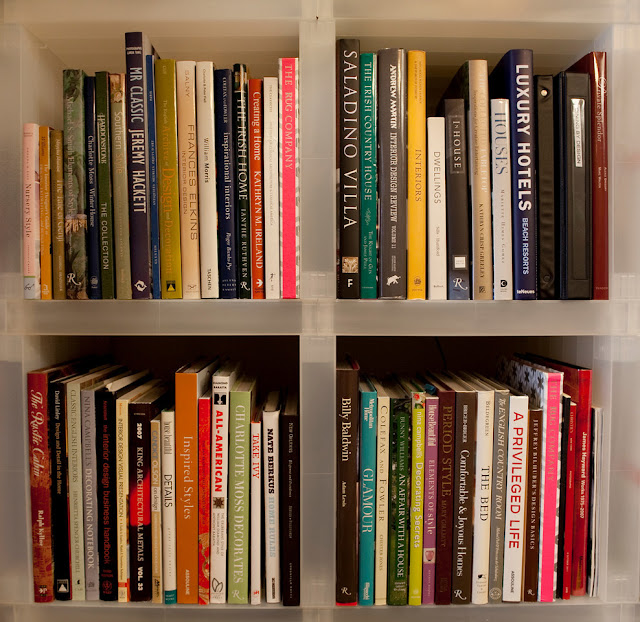
You are a GUI agent. You are given a task and a screenshot of the screen. Output one action in this format:
    pyautogui.click(x=<x>, y=<y>)
    Task: Click on the books
    The height and width of the screenshot is (622, 640).
    Given the screenshot: What is the action you would take?
    pyautogui.click(x=354, y=469), pyautogui.click(x=380, y=476), pyautogui.click(x=438, y=473), pyautogui.click(x=547, y=469), pyautogui.click(x=161, y=458), pyautogui.click(x=73, y=453)